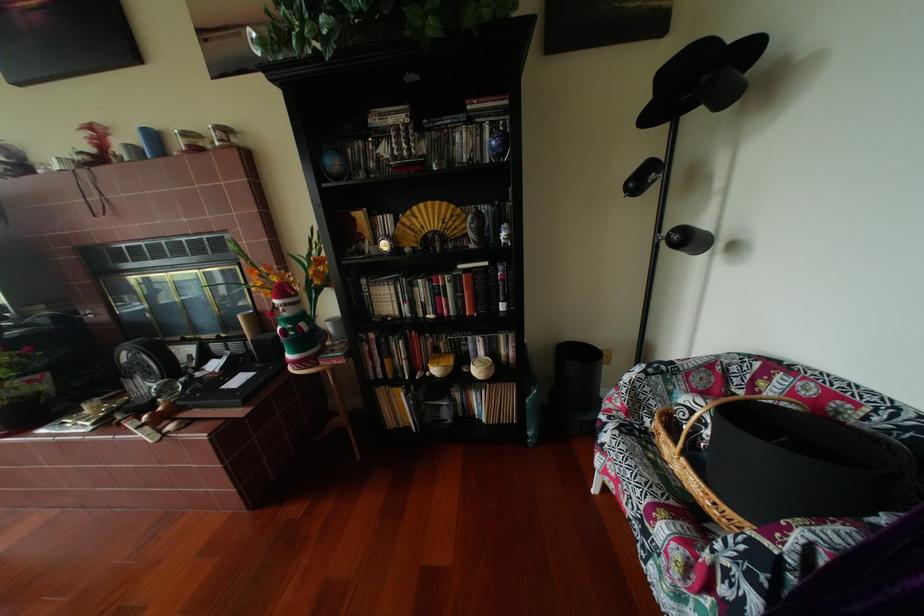
Where would you sit the chair sitting surface? Please return your answer as a coordinate pair (x, y).

(695, 480)